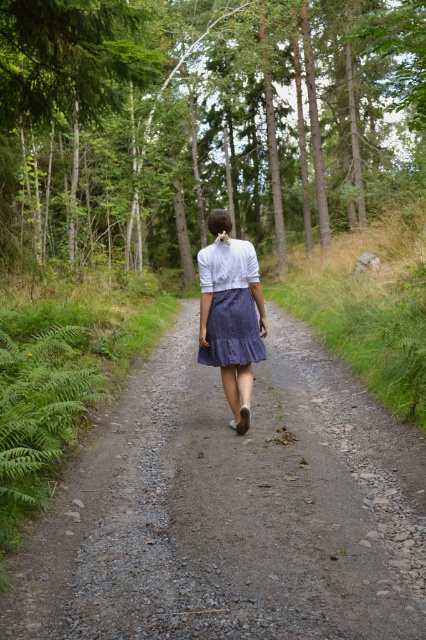
Question: Is green leafy forest at center further to the viewer compared to denim skirt at center?

Choices:
 (A) no
 (B) yes

Answer: (B)

Question: Which of the following is the farthest from the observer?

Choices:
 (A) dirt path at center
 (B) denim skirt at center
 (C) green leafy forest at center

Answer: (C)

Question: Which point is farther from the camera taking this photo?

Choices:
 (A) (249, 296)
 (B) (62, 54)
 (C) (238, 593)

Answer: (B)

Question: Which of these objects is positioned farthest from the denim skirt at center?

Choices:
 (A) green leafy forest at center
 (B) dirt path at center

Answer: (A)

Question: Can you confirm if green leafy forest at center is positioned above dirt path at center?

Choices:
 (A) no
 (B) yes

Answer: (B)

Question: Is the position of green leafy forest at center less distant than that of denim skirt at center?

Choices:
 (A) yes
 (B) no

Answer: (B)